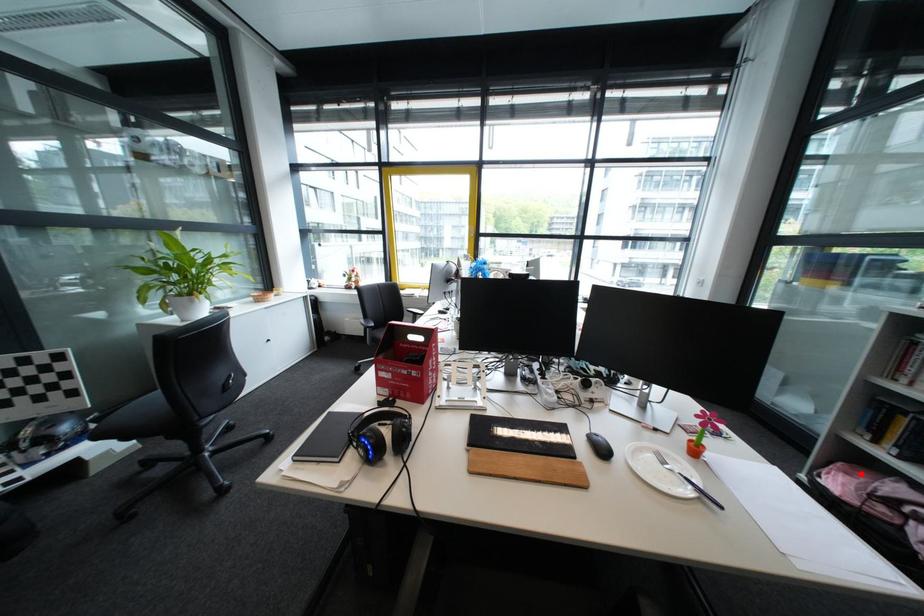
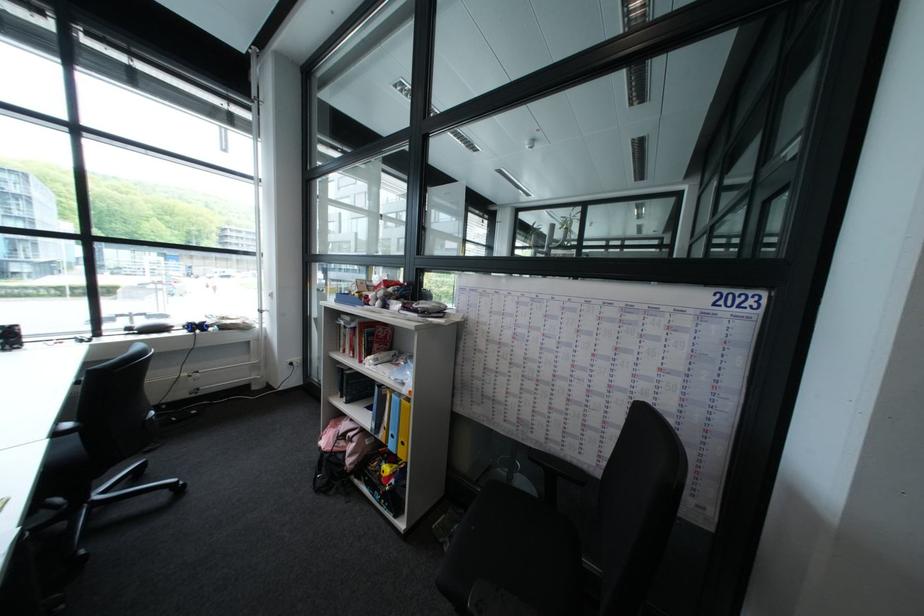
In the second image, find the point that corresponds to the highlighted location in the first image.

(348, 428)